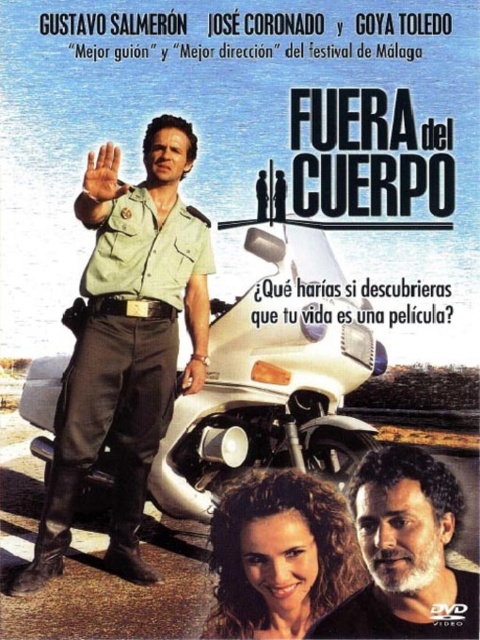
Question: Which point is closer to the camera taking this photo?

Choices:
 (A) (420, 636)
 (B) (292, 259)

Answer: (A)

Question: Is green uniform at center to the left of white glossy motorcycle at center from the viewer's perspective?

Choices:
 (A) yes
 (B) no

Answer: (A)

Question: Which object is positioned farthest from the green uniform at center?

Choices:
 (A) bearded man at lower right
 (B) white glossy motorcycle at center

Answer: (A)

Question: Is white glossy motorcycle at center to the right of bearded man at lower right from the viewer's perspective?

Choices:
 (A) yes
 (B) no

Answer: (B)

Question: Can you confirm if green uniform at center is positioned above bearded man at lower right?

Choices:
 (A) yes
 (B) no

Answer: (A)

Question: Which object appears farthest from the camera in this image?

Choices:
 (A) bearded man at lower right
 (B) green uniform at center

Answer: (B)